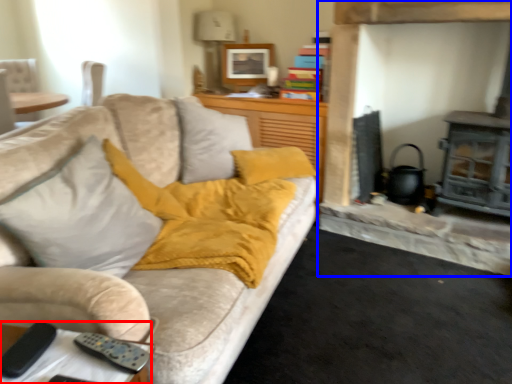
Question: Which object is further to the camera taking this photo, table (highlighted by a red box) or fireplace (highlighted by a blue box)?

Choices:
 (A) table
 (B) fireplace

Answer: (B)